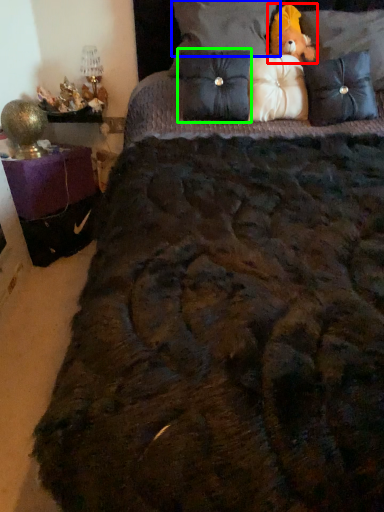
Question: Which object is the closest to the figurine (highlighted by a red box)? Choose among these: pillow (highlighted by a blue box) or pillow (highlighted by a green box).

Choices:
 (A) pillow
 (B) pillow

Answer: (A)